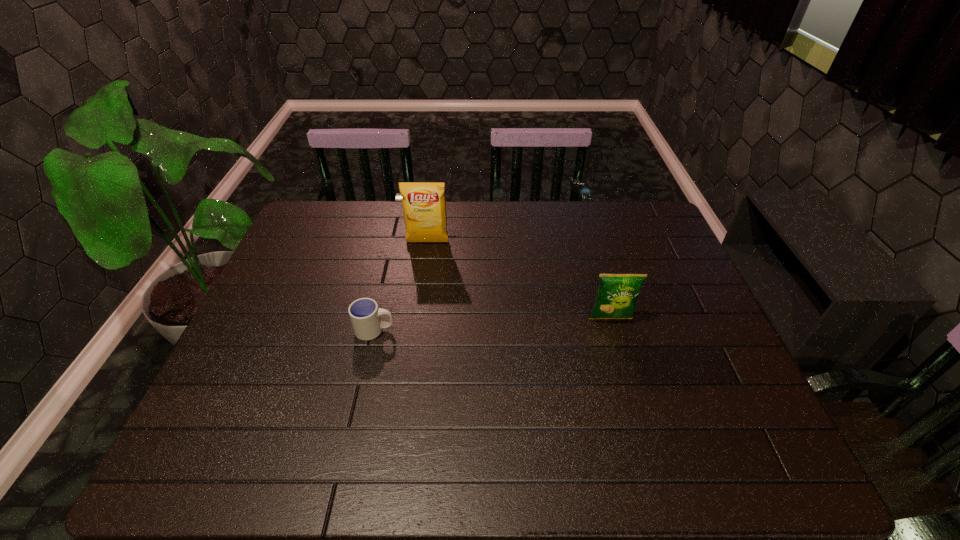
The height and width of the screenshot is (540, 960). I want to click on free spot that satisfies the following two spatial constraints: 1. on the front-facing side of the shorter crisp (potato chip); 2. with the handle on the side of the cup, so click(x=613, y=330).